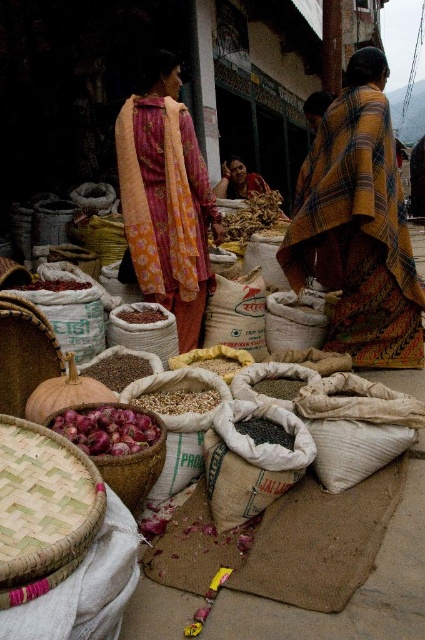
Question: Which object is the farthest from the bamboo weave basket at lower left?

Choices:
 (A) plaid fabric shawl at center
 (B) brown grainy seeds at center

Answer: (A)

Question: Is red onion at center positioned behind black matte seeds at center?

Choices:
 (A) no
 (B) yes

Answer: (A)

Question: Is the position of purple glossy onions at center more distant than that of black matte seeds at center?

Choices:
 (A) no
 (B) yes

Answer: (A)

Question: Observing the image, what is the correct spatial positioning of bamboo weave basket at lower left in reference to black matte seeds at center?

Choices:
 (A) above
 (B) below

Answer: (A)

Question: Which of the following is the closest to the observer?

Choices:
 (A) (119, 408)
 (B) (132, 310)
 (C) (3, 582)
 (D) (51, 282)

Answer: (C)

Question: Based on their relative distances, which object is farther from the floral silk saree at center?

Choices:
 (A) brown grainy seeds at center
 (B) black matte seeds at center
 (C) red onion at center
 (D) purple glossy onions at center

Answer: (D)